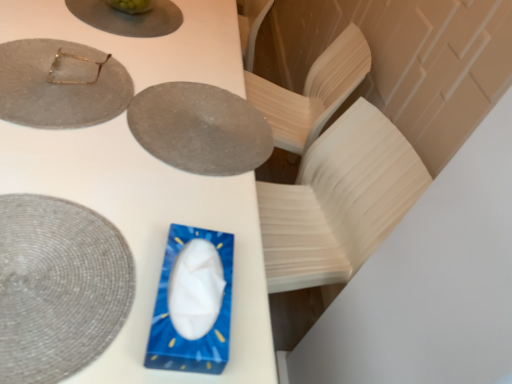
Where is `free space behind matte gray placemat at upper left, which appears as the third plate when ordered from the bottom`? free space behind matte gray placemat at upper left, which appears as the third plate when ordered from the bottom is located at coordinates (124, 36).